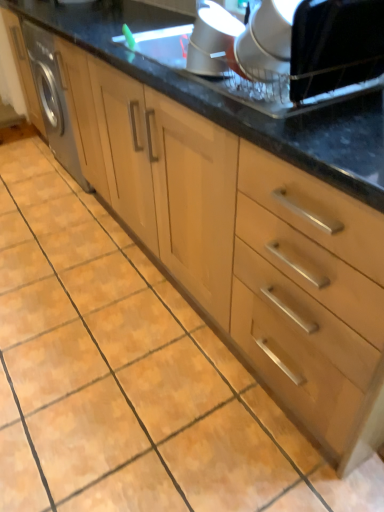
Question: From their relative heights in the image, would you say black fabric at upper right, which appears as the 1th appliance when viewed from the right, is taller or shorter than satin silver vent at upper center, which is the 1th appliance in left-to-right order?

Choices:
 (A) tall
 (B) short

Answer: (A)

Question: In terms of width, does black fabric at upper right, the 2th appliance viewed from the left, look wider or thinner when compared to satin silver vent at upper center, the second appliance from the right?

Choices:
 (A) wide
 (B) thin

Answer: (A)

Question: Would you say black fabric at upper right, the 2th appliance viewed from the left, is inside or outside satin silver vent at upper center, the second appliance from the right?

Choices:
 (A) inside
 (B) outside

Answer: (B)

Question: In terms of size, does satin silver vent at upper center, the second appliance from the right, appear bigger or smaller than black fabric at upper right, the 2th appliance viewed from the left?

Choices:
 (A) big
 (B) small

Answer: (B)

Question: Visually, is satin silver vent at upper center, which is the 1th appliance in left-to-right order, positioned to the left or to the right of black fabric at upper right, the 2th appliance viewed from the left?

Choices:
 (A) left
 (B) right

Answer: (A)

Question: From a real-world perspective, is satin silver vent at upper center, which is the 1th appliance in left-to-right order, above or below black fabric at upper right, which appears as the 1th appliance when viewed from the right?

Choices:
 (A) below
 (B) above

Answer: (A)

Question: In terms of height, does satin silver vent at upper center, which is the 1th appliance in left-to-right order, look taller or shorter compared to black fabric at upper right, the 2th appliance viewed from the left?

Choices:
 (A) short
 (B) tall

Answer: (A)